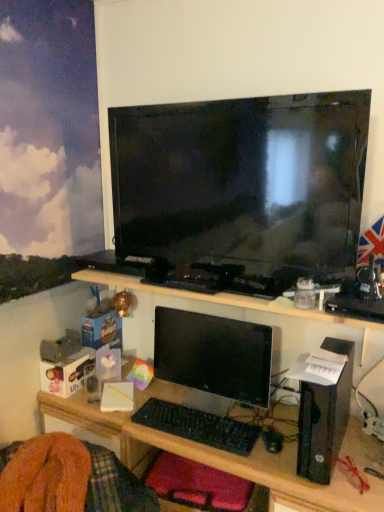
You are a GUI agent. You are given a task and a screenshot of the screen. Output one action in this format:
    pyautogui.click(x=<x>, y=<y>)
    Task: Click on the vacant space underneath black plastic computer at right (from a real-world perspective)
    This screenshot has width=384, height=512.
    Given the screenshot: What is the action you would take?
    pyautogui.click(x=337, y=442)